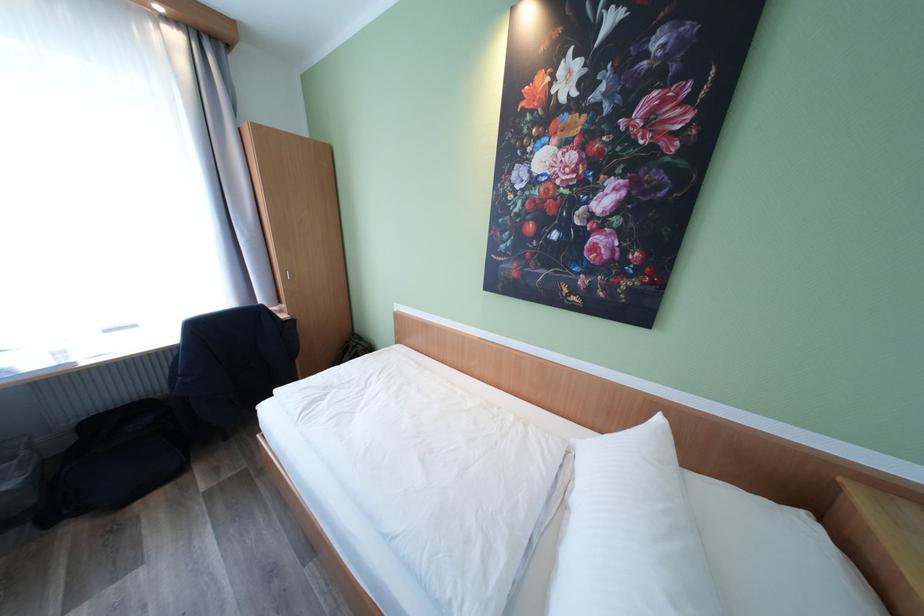
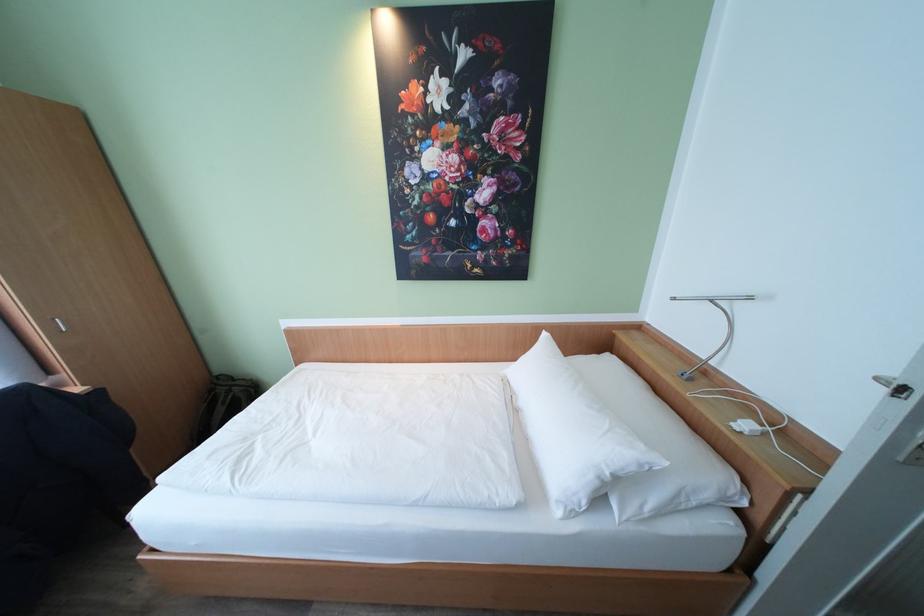
The point at [582,452] is marked in the first image. Where is the corresponding point in the second image?

(513, 379)